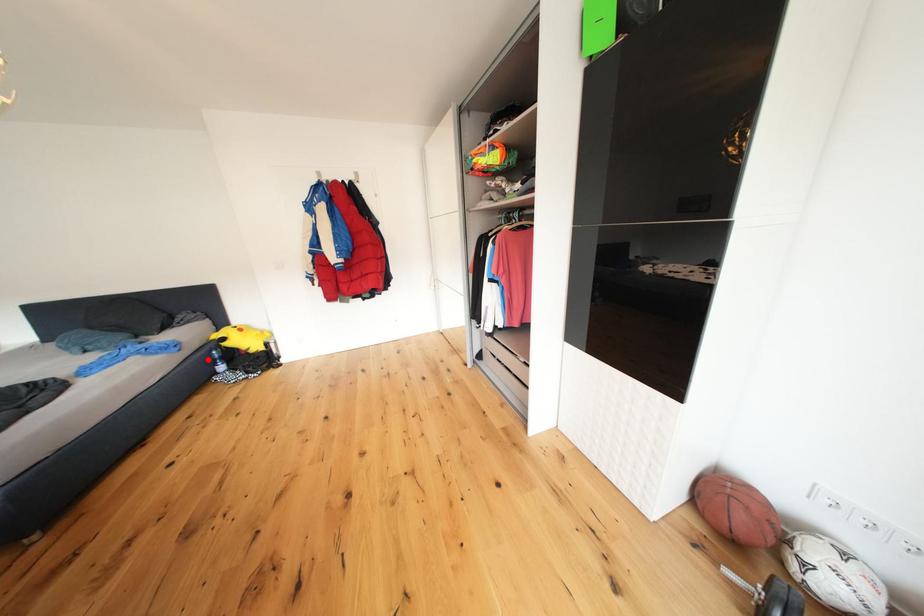
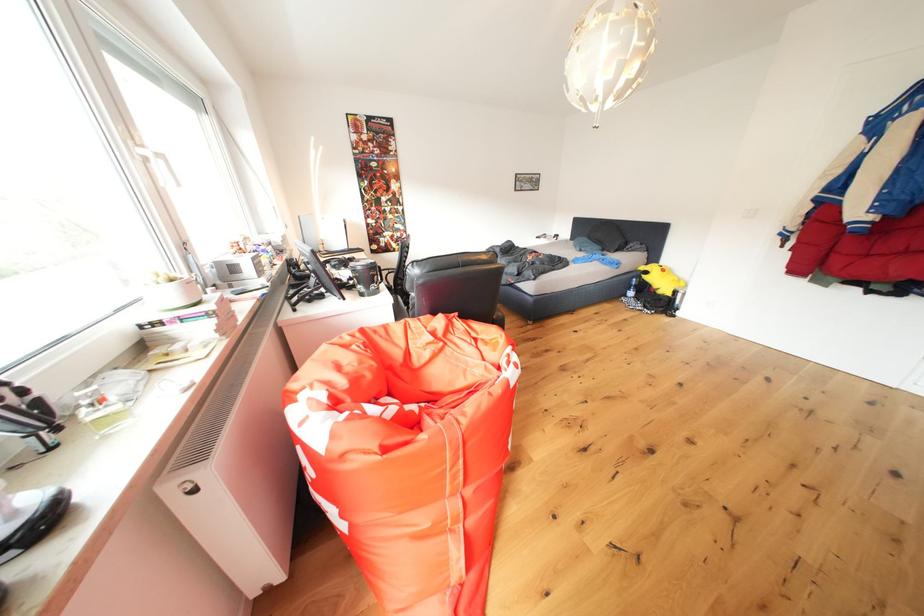
Question: I am providing you with two images of the same scene from different viewpoints. Image1 has a red point marked. In image2, the corresponding 3D location appears at what relative position? Reply with the corresponding letter.

Choices:
 (A) Closer
 (B) Farther

Answer: (B)